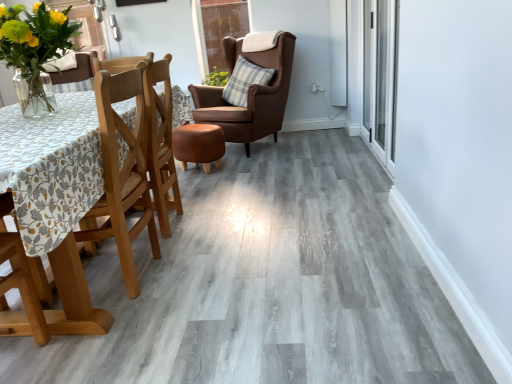
Question: Is wooden chair at left, acting as the first chair starting from the front, to the left of transparent glass door at upper center, the first glass door from the back, from the viewer's perspective?

Choices:
 (A) yes
 (B) no

Answer: (A)

Question: Is wooden chair at left, arranged as the second chair when viewed from the back, facing away from transparent glass door at upper center, which is counted as the 1th glass door, starting from the left?

Choices:
 (A) yes
 (B) no

Answer: (B)

Question: Is the surface of wooden chair at left, which is the 2th chair in top-to-bottom order, in direct contact with transparent glass door at upper center, the second glass door in the front-to-back sequence?

Choices:
 (A) no
 (B) yes

Answer: (A)

Question: Considering the relative sizes of wooden chair at left, acting as the first chair starting from the front, and transparent glass door at upper center, the first glass door from the back, in the image provided, is wooden chair at left, acting as the first chair starting from the front, bigger than transparent glass door at upper center, the first glass door from the back,?

Choices:
 (A) yes
 (B) no

Answer: (A)

Question: Is there a large distance between wooden chair at left, arranged as the 1th chair when ordered from the bottom, and transparent glass door at upper center, the first glass door from the back?

Choices:
 (A) no
 (B) yes

Answer: (B)

Question: Can you confirm if wooden chair at left, acting as the first chair starting from the front, is taller than transparent glass door at upper center, the first glass door from the back?

Choices:
 (A) no
 (B) yes

Answer: (B)

Question: Considering the relative sizes of transparent glass door at upper center, which is counted as the 1th glass door, starting from the left, and white soft pillow at upper left, placed as the 1th pillow when sorted from left to right, in the image provided, is transparent glass door at upper center, which is counted as the 1th glass door, starting from the left, wider than white soft pillow at upper left, placed as the 1th pillow when sorted from left to right,?

Choices:
 (A) yes
 (B) no

Answer: (B)

Question: Is transparent glass door at upper center, the first glass door from the back, smaller than white soft pillow at upper left, acting as the second pillow starting from the right?

Choices:
 (A) no
 (B) yes

Answer: (A)

Question: Is transparent glass door at upper center, the second glass door in the front-to-back sequence, far away from white soft pillow at upper left, placed as the 1th pillow when sorted from left to right?

Choices:
 (A) no
 (B) yes

Answer: (B)

Question: Considering the relative sizes of transparent glass door at upper center, which is counted as the 1th glass door, starting from the left, and white soft pillow at upper left, acting as the second pillow starting from the right, in the image provided, is transparent glass door at upper center, which is counted as the 1th glass door, starting from the left, bigger than white soft pillow at upper left, acting as the second pillow starting from the right,?

Choices:
 (A) yes
 (B) no

Answer: (A)

Question: Considering the relative sizes of transparent glass door at upper center, the first glass door from the back, and white soft pillow at upper left, placed as the 1th pillow when sorted from left to right, in the image provided, is transparent glass door at upper center, the first glass door from the back, thinner than white soft pillow at upper left, placed as the 1th pillow when sorted from left to right,?

Choices:
 (A) yes
 (B) no

Answer: (A)

Question: Is transparent glass door at upper center, which is counted as the 1th glass door, starting from the left, at the left side of white soft pillow at upper left, placed as the 1th pillow when sorted from left to right?

Choices:
 (A) no
 (B) yes

Answer: (A)

Question: Can you confirm if brown leather wingback chair at center, which is counted as the 2th chair, starting from the front, is bigger than plaid fabric pillow at center, marked as the 1th pillow in a right-to-left arrangement?

Choices:
 (A) no
 (B) yes

Answer: (B)